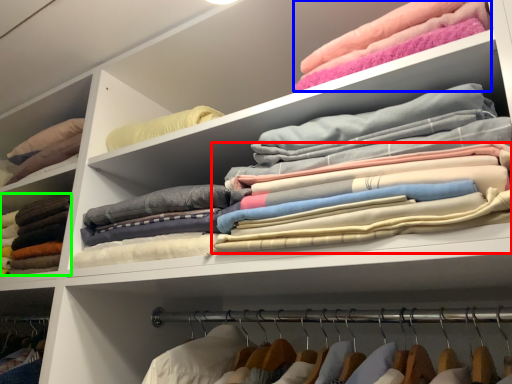
Question: Which object is positioned closest to clothing (highlighted by a red box)? Select from clothing (highlighted by a blue box) and clothing (highlighted by a green box).

Choices:
 (A) clothing
 (B) clothing

Answer: (A)